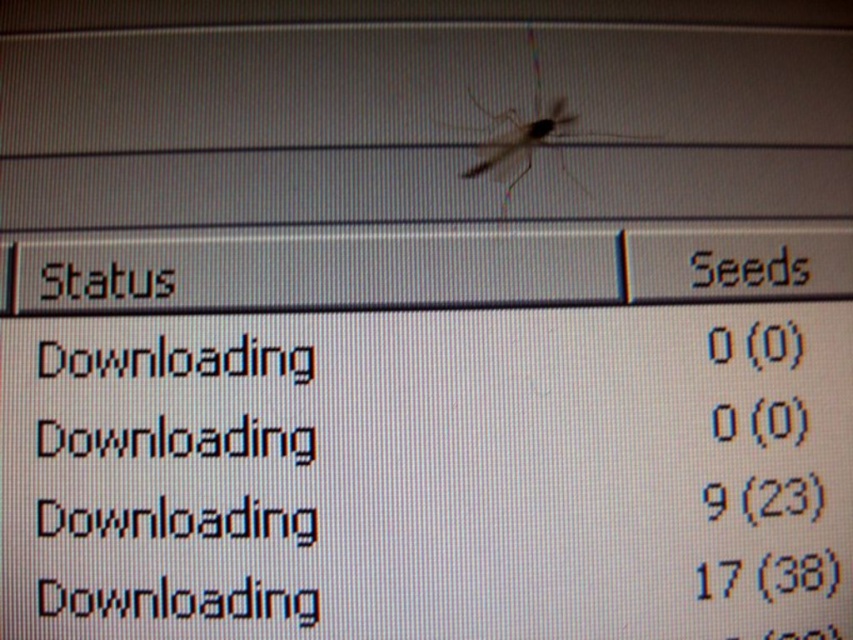
Is translucent glass mosquito at center shorter than black pixelated number at center?

No, translucent glass mosquito at center is not shorter than black pixelated number at center.

Based on the photo, can you confirm if translucent glass mosquito at center is smaller than black pixelated number at center?

No.

At what (x,y) coordinates should I click in order to perform the action: click on translucent glass mosquito at center. Please return your answer as a coordinate pair (x, y). The image size is (853, 640). Looking at the image, I should click on (532, 141).

Locate an element on the screen. translucent glass mosquito at center is located at coordinates (532, 141).

Consider the image. Does black digital number at center appear over black pixelated number at center?

Correct, black digital number at center is located above black pixelated number at center.

Is black digital number at center positioned behind black pixelated number at center?

Yes, black digital number at center is behind black pixelated number at center.

Find the location of a particular element. black digital number at center is located at coordinates (723, 420).

Locate an element on the screen. The width and height of the screenshot is (853, 640). translucent glass mosquito at center is located at coordinates (532, 141).

Does point (550, 138) lie behind point (726, 440)?

Yes, point (550, 138) is farther from viewer.

Find the location of a particular element. translucent glass mosquito at center is located at coordinates tap(532, 141).